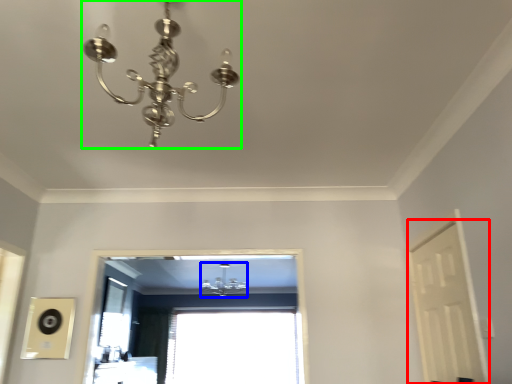
Question: Estimate the real-world distances between objects in this image. Which object is closer to screen door (highlighted by a red box), lamp (highlighted by a blue box) or lamp (highlighted by a green box)?

Choices:
 (A) lamp
 (B) lamp

Answer: (B)